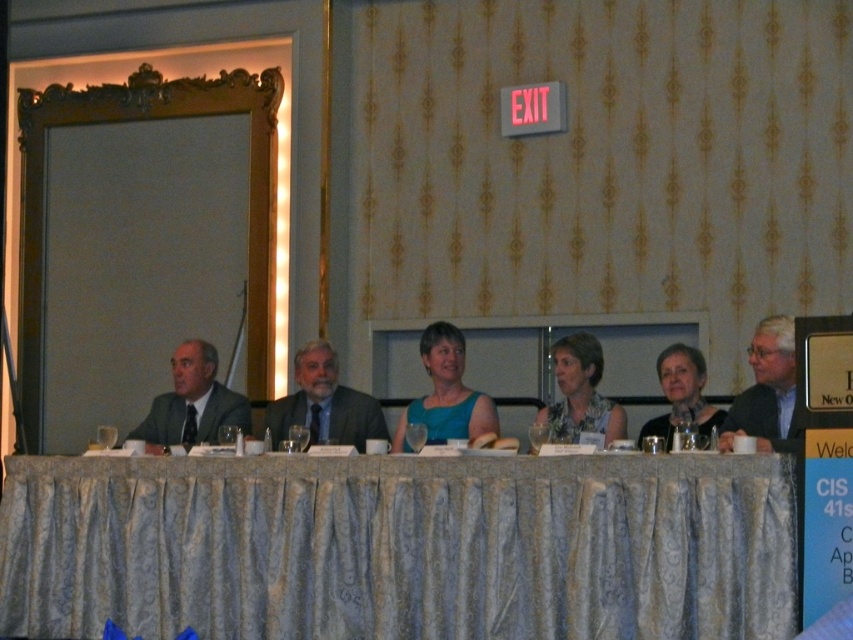
What is located at the coordinates point (767, 392) in the image?

The gray suit at center is located at point (767, 392).

You are organizing a photo shoot and need to ensure proper lighting for two key subjects at the table. The gray suit at center and the blue floral dress at center are both important. Based on their positions, which one might require more downward lighting to avoid shadows on their face?

The gray suit at center is above the blue floral dress at center, so it might require more downward lighting to avoid shadows on its face since it is positioned higher.

You are organizing a photo shoot and need to ensure that the gray suit at center and the matte blue dress at center are positioned so that their combined width does not exceed 1.2 meters. Given their individual widths, will they fit together within this constraint?

The gray suit at center has a width less than the matte blue dress at center. However, without knowing the exact widths of both items, it is impossible to determine if their combined width will exceed 1.2 meters. Additional measurements are required to confirm.